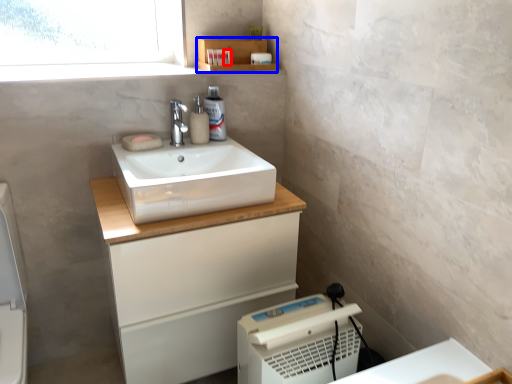
Question: Which point is further to the camera, toiletry (highlighted by a red box) or shelf (highlighted by a blue box)?

Choices:
 (A) toiletry
 (B) shelf

Answer: (A)